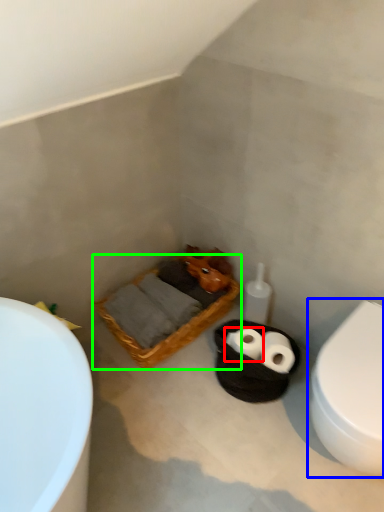
Question: Which object is positioned closest to toilet paper (highlighted by a red box)? Select from toilet (highlighted by a blue box) and basket (highlighted by a green box).

Choices:
 (A) toilet
 (B) basket

Answer: (B)